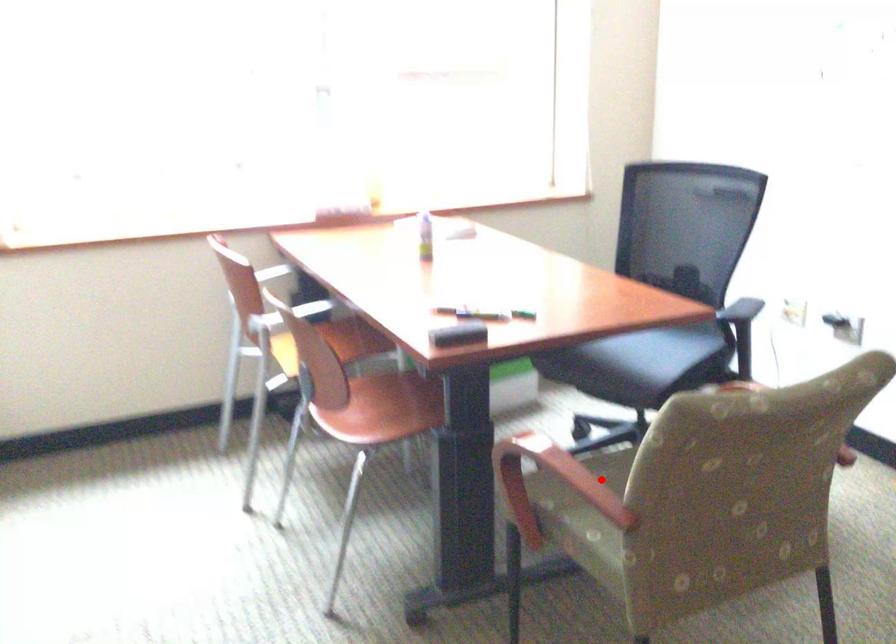
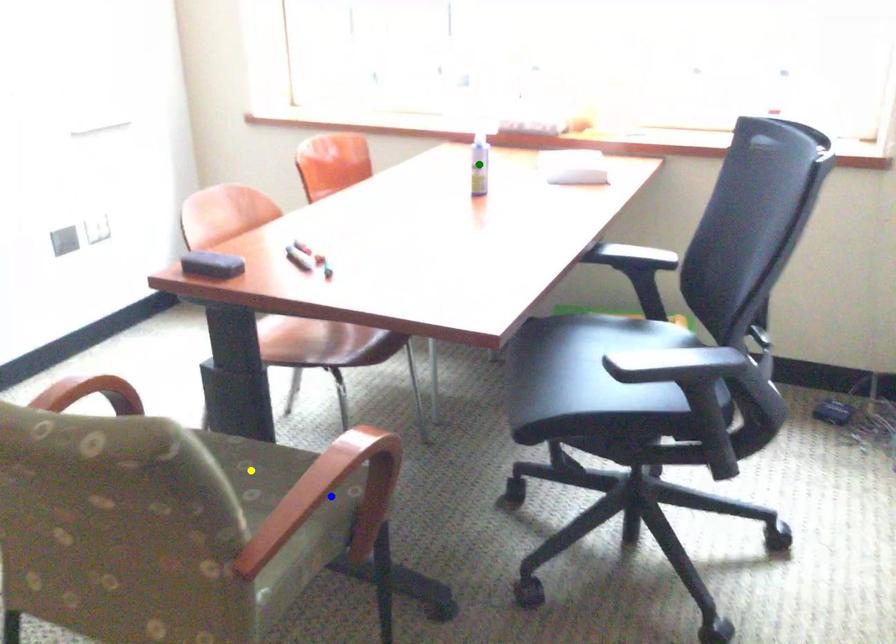
Question: I am providing you with two images of the same scene from different viewpoints. A red point is marked on the first image. You are given multiple points on the second image. Which point in image 2 represents the same 3d spot as the red point in image 1?

Choices:
 (A) green point
 (B) yellow point
 (C) blue point

Answer: (B)